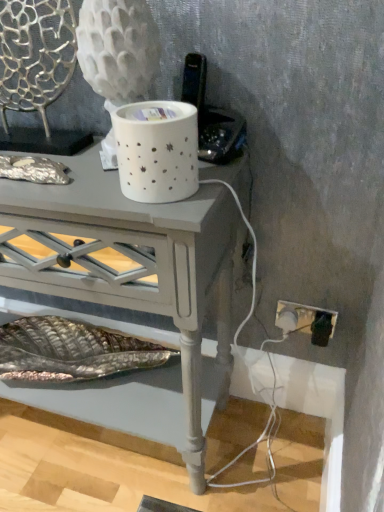
Question: Is matte gray table at center shorter than metallic silver swivel chair at upper left?

Choices:
 (A) no
 (B) yes

Answer: (A)

Question: From a real-world perspective, is matte gray table at center below metallic silver swivel chair at upper left?

Choices:
 (A) yes
 (B) no

Answer: (A)

Question: From the image's perspective, is matte gray table at center located above metallic silver swivel chair at upper left?

Choices:
 (A) no
 (B) yes

Answer: (A)

Question: From the image's perspective, is matte gray table at center below metallic silver swivel chair at upper left?

Choices:
 (A) yes
 (B) no

Answer: (A)

Question: Can you confirm if matte gray table at center is positioned to the left of metallic silver swivel chair at upper left?

Choices:
 (A) yes
 (B) no

Answer: (B)

Question: Considering the relative sizes of matte gray table at center and metallic silver swivel chair at upper left in the image provided, is matte gray table at center bigger than metallic silver swivel chair at upper left?

Choices:
 (A) yes
 (B) no

Answer: (A)

Question: Is metallic silver swivel chair at upper left positioned beyond the bounds of matte gray table at center?

Choices:
 (A) yes
 (B) no

Answer: (A)

Question: Is metallic silver swivel chair at upper left not close to matte gray table at center?

Choices:
 (A) yes
 (B) no

Answer: (B)

Question: Is metallic silver swivel chair at upper left at the left side of matte gray table at center?

Choices:
 (A) yes
 (B) no

Answer: (A)

Question: From the image's perspective, is metallic silver swivel chair at upper left on matte gray table at center?

Choices:
 (A) yes
 (B) no

Answer: (A)

Question: Is metallic silver swivel chair at upper left smaller than matte gray table at center?

Choices:
 (A) no
 (B) yes

Answer: (B)

Question: Considering the relative sizes of metallic silver swivel chair at upper left and matte gray table at center in the image provided, is metallic silver swivel chair at upper left thinner than matte gray table at center?

Choices:
 (A) no
 (B) yes

Answer: (B)

Question: From the image's perspective, is metallic silver swivel chair at upper left positioned above or below matte gray table at center?

Choices:
 (A) below
 (B) above

Answer: (B)